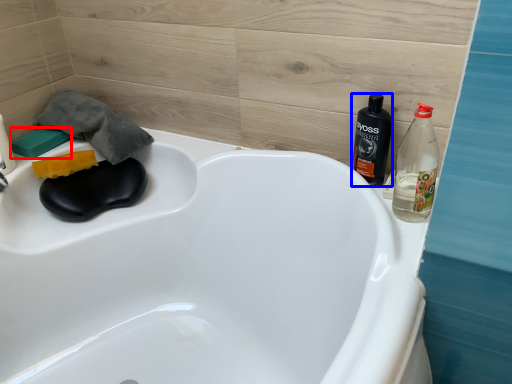
Question: Among these objects, which one is nearest to the camera, soap (highlighted by a red box) or bottle (highlighted by a blue box)?

Choices:
 (A) soap
 (B) bottle

Answer: (B)